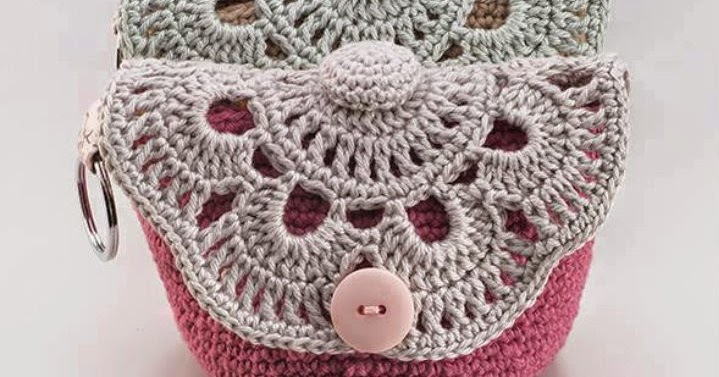
Where is `white surface counter`? white surface counter is located at coordinates 620,341.